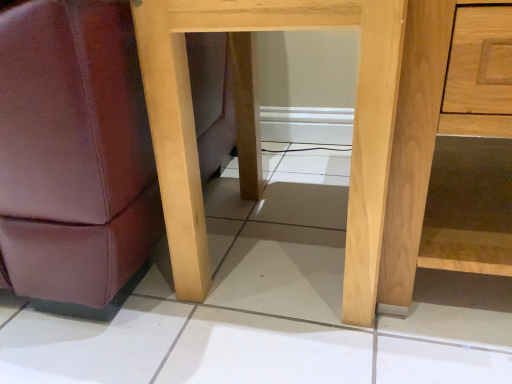
This screenshot has height=384, width=512. In order to click on free point in front of natural wood table at center in this screenshot , I will do `click(288, 350)`.